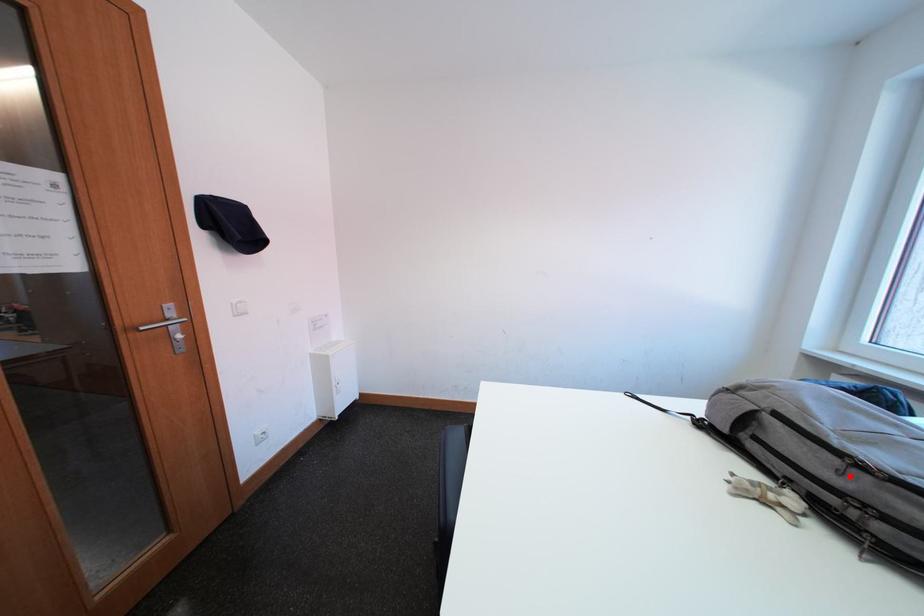
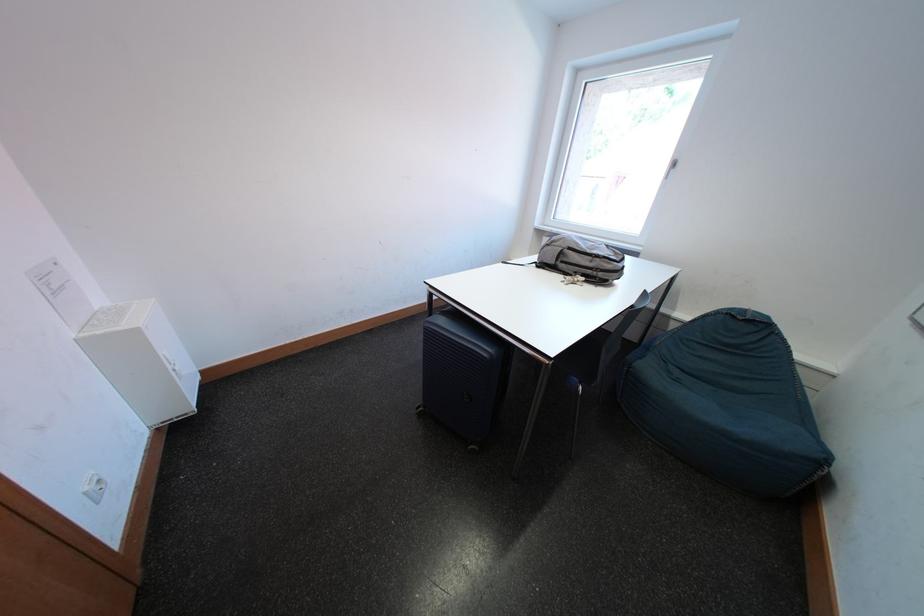
Question: I am providing you with two images of the same scene from different viewpoints. Image1 has a red point marked. In image2, the corresponding 3D location appears at what relative position? Reply with the corresponding letter.

Choices:
 (A) Closer
 (B) Farther

Answer: (A)